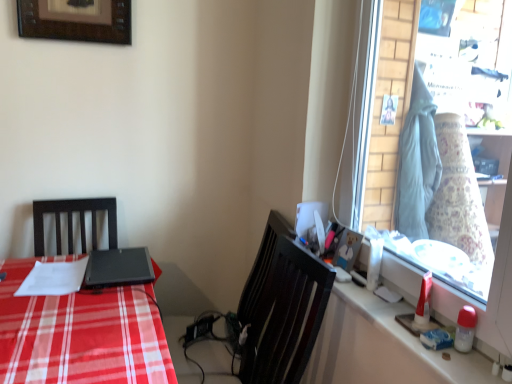
How much space does matte plastic picture frame at upper right, the 2th picture frame viewed from the left, occupy vertically?

5.96 inches.

In order to face black matte laptop at center, should I rotate leftwards or rightwards?

Turn left approximately 17.526 degrees to face it.

What do you see at coordinates (80, 334) in the screenshot? The width and height of the screenshot is (512, 384). I see `matte black desk at left` at bounding box center [80, 334].

You are a GUI agent. You are given a task and a screenshot of the screen. Output one action in this format:
    pyautogui.click(x=<x>, y=<y>)
    Task: Click on the wooden framed picture at upper left, arranged as the second picture frame when viewed from the right
    This screenshot has height=384, width=512.
    Given the screenshot: What is the action you would take?
    76,20

What are the coordinates of `matte plastic picture frame at upper right, the 2th picture frame in the top-to-bottom sequence` in the screenshot? It's located at (347, 249).

From the image's perspective, which is below, black matte laptop at center or matte black desk at left?

matte black desk at left appears lower in the image.

Does black matte laptop at center come in front of matte black desk at left?

That is False.

Is black matte laptop at center far from matte black desk at left?

No, there isn't a large distance between black matte laptop at center and matte black desk at left.

Consider the image. Is black matte laptop at center thinner than wooden framed picture at upper left, the 1th picture frame viewed from the back?

No.

Looking at this image, looking at the image, does black matte laptop at center seem bigger or smaller compared to wooden framed picture at upper left, positioned as the first picture frame in left-to-right order?

Considering their sizes, black matte laptop at center takes up less space than wooden framed picture at upper left, positioned as the first picture frame in left-to-right order.

Is black matte laptop at center in front of or behind wooden framed picture at upper left, positioned as the 2th picture frame in bottom-to-top order, in the image?

In the image, black matte laptop at center appears in front of wooden framed picture at upper left, positioned as the 2th picture frame in bottom-to-top order.

From a real-world perspective, which is physically above, matte plastic picture frame at upper right, which is the 2th picture frame from back to front, or white glossy counter top at right?

matte plastic picture frame at upper right, which is the 2th picture frame from back to front, is physically above.

Would you consider matte plastic picture frame at upper right, which is the 2th picture frame from back to front, to be distant from white glossy counter top at right?

No, matte plastic picture frame at upper right, which is the 2th picture frame from back to front, is not far from white glossy counter top at right.

Between matte plastic picture frame at upper right, the 1th picture frame viewed from the front, and white glossy counter top at right, which one appears on the left side from the viewer's perspective?

matte plastic picture frame at upper right, the 1th picture frame viewed from the front, is more to the left.

Can you see matte black desk at left touching white glossy counter top at right?

No, matte black desk at left is not beside white glossy counter top at right.

How many degrees apart are the facing directions of matte black desk at left and white glossy counter top at right?

There is a 90.8-degree angle between the facing directions of matte black desk at left and white glossy counter top at right.

In terms of width, does matte black desk at left look wider or thinner when compared to white glossy counter top at right?

In the image, matte black desk at left appears to be wider than white glossy counter top at right.

Considering the sizes of objects matte black desk at left and white glossy counter top at right in the image provided, who is smaller, matte black desk at left or white glossy counter top at right?

white glossy counter top at right is smaller.

Considering the sizes of objects matte plastic picture frame at upper right, the 2th picture frame viewed from the left, and black matte laptop at center in the image provided, who is thinner, matte plastic picture frame at upper right, the 2th picture frame viewed from the left, or black matte laptop at center?

Thinner between the two is matte plastic picture frame at upper right, the 2th picture frame viewed from the left.

From the image's perspective, who appears lower, matte plastic picture frame at upper right, which ranks as the first picture frame in bottom-to-top order, or black matte laptop at center?

black matte laptop at center, from the image's perspective.

Is point (339, 247) less distant than point (135, 269)?

Yes, it is in front of point (135, 269).

From a real-world perspective, which is physically below, matte plastic picture frame at upper right, the 1th picture frame viewed from the front, or black matte laptop at center?

black matte laptop at center, from a real-world perspective.

Is black matte laptop at center outside of matte plastic picture frame at upper right, which ranks as the first picture frame in bottom-to-top order?

black matte laptop at center lies outside matte plastic picture frame at upper right, which ranks as the first picture frame in bottom-to-top order,'s area.

Which is behind, black matte laptop at center or matte plastic picture frame at upper right, the 2th picture frame viewed from the left?

black matte laptop at center is further away from the camera.

Does point (148, 259) appear closer or farther from the camera than point (342, 236)?

Point (148, 259) is positioned farther from the camera compared to point (342, 236).

Find the location of a particular element. The height and width of the screenshot is (384, 512). the 1st picture frame positioned above the white glossy counter top at right (from a real-world perspective) is located at coordinates (347, 249).

Is white glossy counter top at right positioned with its back to matte plastic picture frame at upper right, which ranks as the first picture frame in bottom-to-top order?

That's not correct — white glossy counter top at right is not looking away from matte plastic picture frame at upper right, which ranks as the first picture frame in bottom-to-top order.

Considering the relative sizes of white glossy counter top at right and matte plastic picture frame at upper right, the 2th picture frame viewed from the left, in the image provided, is white glossy counter top at right shorter than matte plastic picture frame at upper right, the 2th picture frame viewed from the left,?

Yes, white glossy counter top at right is shorter than matte plastic picture frame at upper right, the 2th picture frame viewed from the left.

From a real-world perspective, is white glossy counter top at right positioned under matte plastic picture frame at upper right, which ranks as the first picture frame in bottom-to-top order, based on gravity?

Indeed, from a real-world perspective, white glossy counter top at right is positioned beneath matte plastic picture frame at upper right, which ranks as the first picture frame in bottom-to-top order.

This screenshot has height=384, width=512. Find the location of `desk lying in front of the black matte laptop at center`. desk lying in front of the black matte laptop at center is located at coordinates (80, 334).

Locate an element on the screen. laptop below the wooden framed picture at upper left, the 1th picture frame viewed from the back (from a real-world perspective) is located at coordinates 118,268.

Estimate the real-world distances between objects in this image. Which object is further from white glossy counter top at right, glass window at right or matte plastic picture frame at upper right, the 1th picture frame viewed from the front?

glass window at right.

Considering their positions, is wooden framed picture at upper left, arranged as the second picture frame when viewed from the right, positioned closer to white glossy counter top at right than glass window at right?

Based on the image, glass window at right appears to be nearer to white glossy counter top at right.

Which object lies nearer to the anchor point matte plastic picture frame at upper right, the 2th picture frame viewed from the left, white glossy counter top at right or black matte laptop at center?

white glossy counter top at right is positioned closer to the anchor matte plastic picture frame at upper right, the 2th picture frame viewed from the left.

Which object lies nearer to the anchor point white glossy counter top at right, matte black desk at left or wooden framed picture at upper left, positioned as the first picture frame in left-to-right order?

matte black desk at left is positioned closer to the anchor white glossy counter top at right.

Estimate the real-world distances between objects in this image. Which object is further from matte plastic picture frame at upper right, which ranks as the first picture frame in bottom-to-top order, glass window at right or black matte laptop at center?

Among the two, black matte laptop at center is located further to matte plastic picture frame at upper right, which ranks as the first picture frame in bottom-to-top order.

Estimate the real-world distances between objects in this image. Which object is closer to white glossy counter top at right, matte plastic picture frame at upper right, which is the 2th picture frame from back to front, or black matte laptop at center?

Among the two, matte plastic picture frame at upper right, which is the 2th picture frame from back to front, is located nearer to white glossy counter top at right.

From the image, which object appears to be farther from matte plastic picture frame at upper right, the 2th picture frame viewed from the left, wooden framed picture at upper left, positioned as the 2th picture frame in bottom-to-top order, or white glossy counter top at right?

wooden framed picture at upper left, positioned as the 2th picture frame in bottom-to-top order, is positioned further to the anchor matte plastic picture frame at upper right, the 2th picture frame viewed from the left.

Looking at the image, which one is located closer to glass window at right, matte black desk at left or white glossy counter top at right?

The object closer to glass window at right is white glossy counter top at right.

Locate an element on the screen. counter top between matte black desk at left and glass window at right is located at coordinates (382, 346).

Identify the location of picture frame between black matte laptop at center and white glossy counter top at right in the horizontal direction. (347, 249).

Identify the location of laptop between wooden framed picture at upper left, positioned as the first picture frame in left-to-right order, and white glossy counter top at right, in the vertical direction. This screenshot has width=512, height=384. (118, 268).

Where is `laptop between matte black desk at left and white glossy counter top at right from left to right`? This screenshot has height=384, width=512. laptop between matte black desk at left and white glossy counter top at right from left to right is located at coordinates (118, 268).